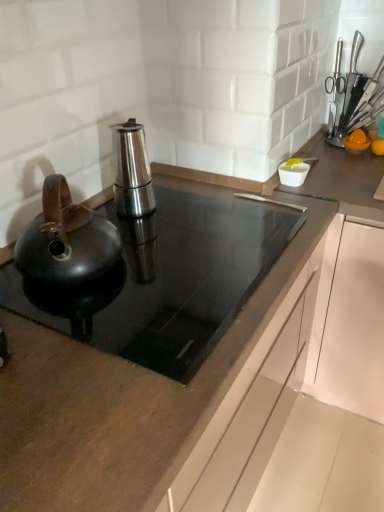
This screenshot has height=512, width=384. I want to click on free point in front of shiny black kettle at left, positioned as the second kitchen appliance in back-to-front order, so click(x=78, y=327).